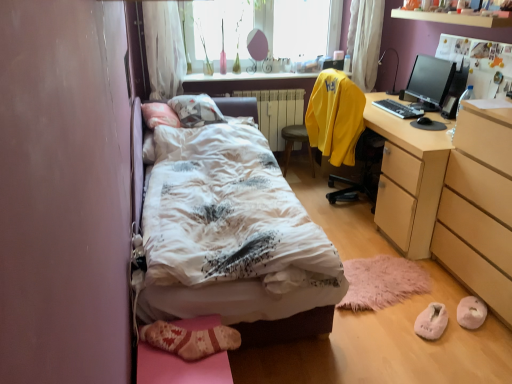
This screenshot has width=512, height=384. I want to click on vacant region above knitted wool socks at lower left, the third shoe from the right (from a real-world perspective), so click(x=183, y=352).